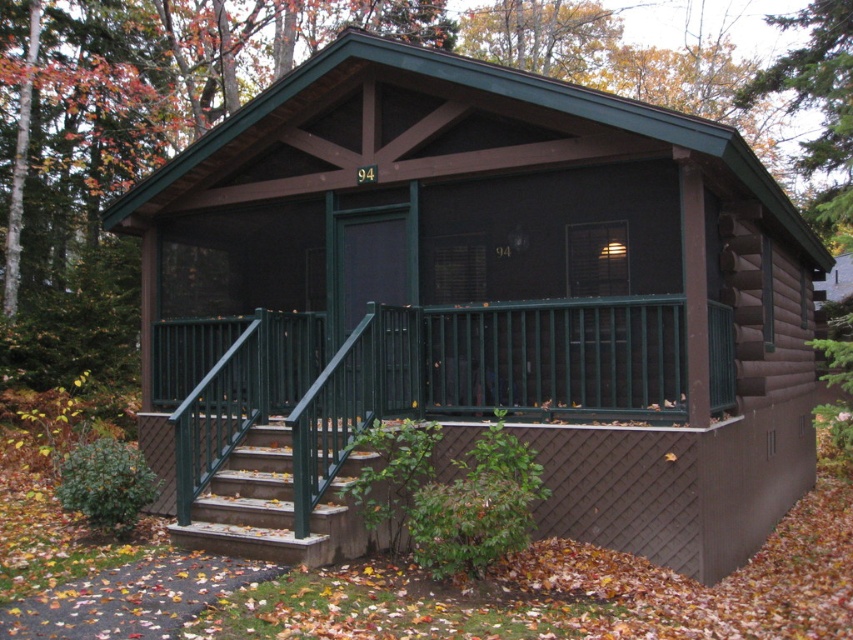
Question: Does green concrete stairs at lower left appear on the left side of green wood tree at upper right?

Choices:
 (A) no
 (B) yes

Answer: (B)

Question: Can you confirm if green metal railing at center is positioned above green wood tree at upper right?

Choices:
 (A) yes
 (B) no

Answer: (B)

Question: Can you confirm if green metal railing at center is positioned to the right of green concrete stairs at lower left?

Choices:
 (A) no
 (B) yes

Answer: (B)

Question: Which object appears farthest from the camera in this image?

Choices:
 (A) green metal railing at center
 (B) green concrete stairs at lower left

Answer: (A)

Question: Which is nearer to the green wood tree at upper right?

Choices:
 (A) green metal railing at center
 (B) green concrete stairs at lower left

Answer: (A)

Question: Which object is closer to the camera taking this photo?

Choices:
 (A) green wood tree at upper right
 (B) green concrete stairs at lower left

Answer: (B)